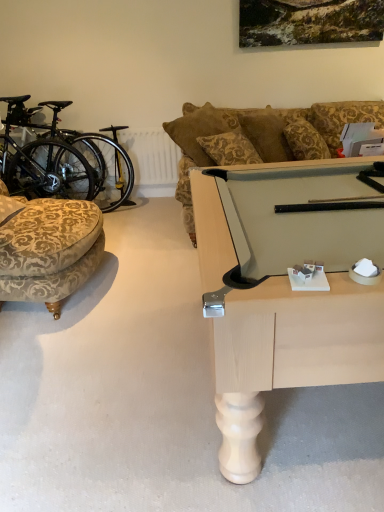
At what (x,y) coordinates should I click in order to perform the action: click on free point in front of velvet-patterned ottoman at left. Please return your answer as a coordinate pair (x, y). The height and width of the screenshot is (512, 384). Looking at the image, I should click on (72, 346).